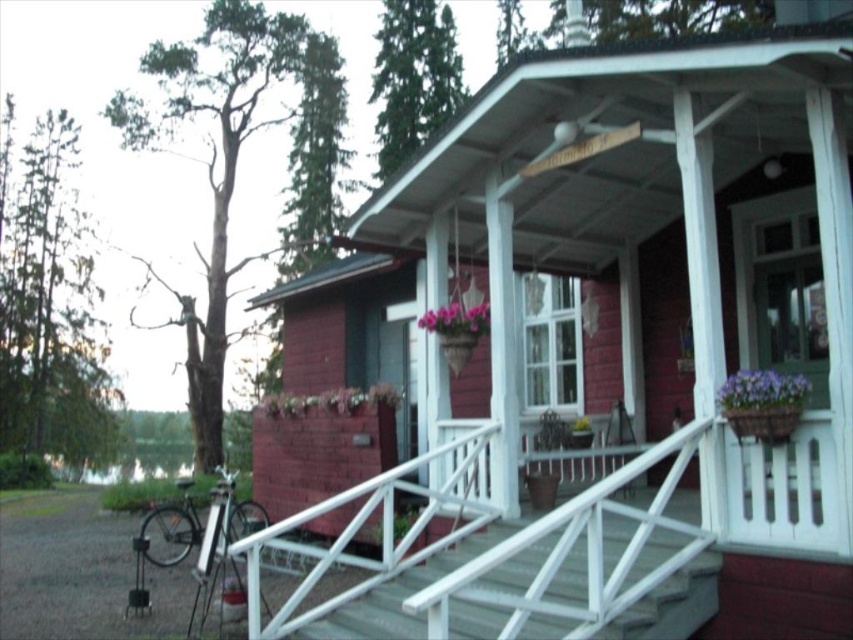
Question: Which object is farther from the camera taking this photo?

Choices:
 (A) purple fabric flower at center
 (B) white painted wood porch at center
 (C) matte red cabin at center
 (D) green water at lower left

Answer: (D)

Question: Which point is farther to the camera?

Choices:
 (A) matte red cabin at center
 (B) purple matte flower pot at center

Answer: (A)

Question: Is matte red cabin at center to the left of purple fabric flower at center from the viewer's perspective?

Choices:
 (A) no
 (B) yes

Answer: (A)

Question: Estimate the real-world distances between objects in this image. Which object is farther from the purple matte flower pot at center?

Choices:
 (A) white wooden stairs at center
 (B) purple fabric flower at center
 (C) purple matte flower pot at right

Answer: (C)

Question: Does white painted wood porch at center have a smaller size compared to green water at lower left?

Choices:
 (A) yes
 (B) no

Answer: (A)

Question: Can you confirm if white painted wood porch at center is positioned above purple matte flower pot at center?

Choices:
 (A) no
 (B) yes

Answer: (B)